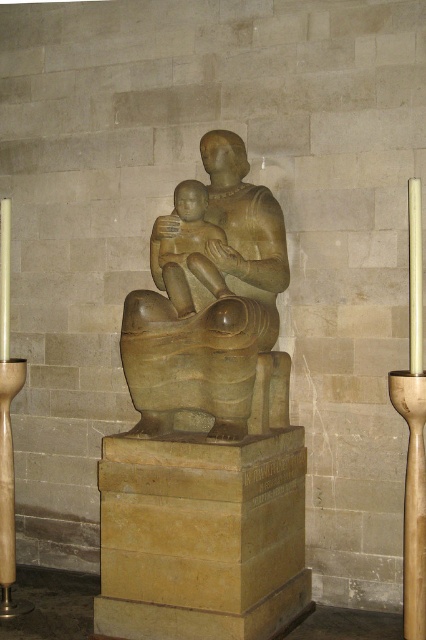
Is yellow stone pedestal at center thinner than matte bronze statue at center?

No.

Is point (210, 500) farther from camera compared to point (170, 243)?

No, it is in front of (170, 243).

Where is `yellow stone pedestal at center`? yellow stone pedestal at center is located at coordinates (x=201, y=536).

Based on the photo, between matte stone statue at center and wooden candlestick at right, which one has more height?

With more height is matte stone statue at center.

Is matte stone statue at center behind wooden candlestick at right?

Yes, matte stone statue at center is further from the viewer.

Which is in front, point (178, 292) or point (411, 412)?

Point (411, 412)

Find the location of a particular element. matte stone statue at center is located at coordinates (212, 305).

Is the position of matte bronze statue at center more distant than that of wooden candle holder at lower left?

No, matte bronze statue at center is in front of wooden candle holder at lower left.

Is point (184, 225) behind point (14, 616)?

No, it is in front of (14, 616).

Is point (169, 250) farther from camera compared to point (5, 589)?

No, (169, 250) is closer to viewer.

Locate an element on the screen. The height and width of the screenshot is (640, 426). matte bronze statue at center is located at coordinates (187, 250).